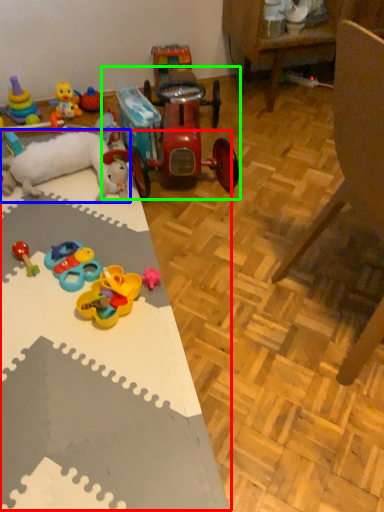
Question: Which object is the closest to the table (highlighted by a red box)? Choose among these: toy (highlighted by a blue box) or toy (highlighted by a green box).

Choices:
 (A) toy
 (B) toy

Answer: (A)